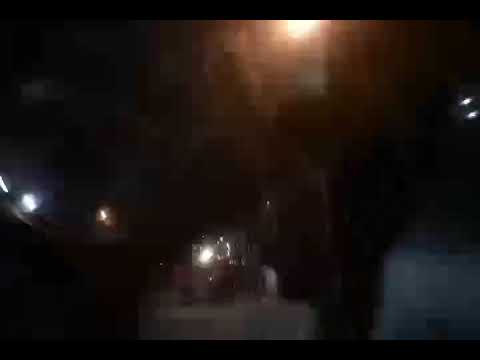
The height and width of the screenshot is (360, 480). Identify the location of orange area around light. (278, 37).